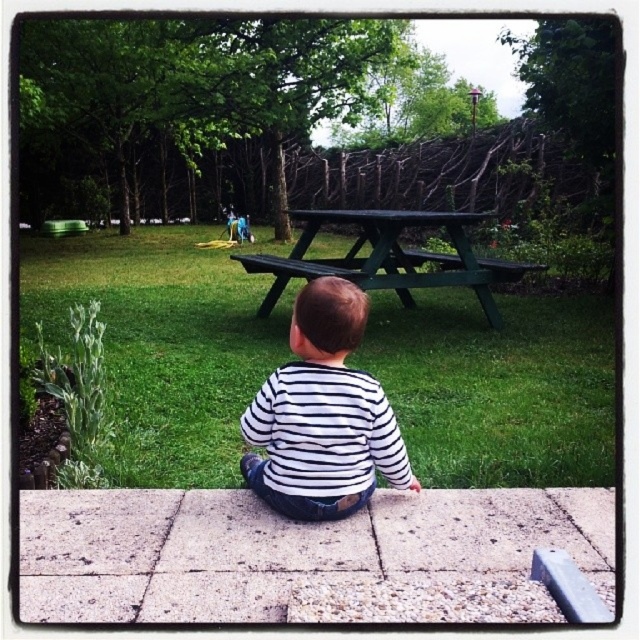
In the park scene, you see a child sitting on a paved area and two objects in the middle ground. Which object is positioned to the left of the other between the green grass at center and the green matte picnic table at center?

The green grass at center is to the left of the green matte picnic table at center.

You are a parent trying to decide where to place a small toy for your child to find. The toy is 30 cm wide. You have two options in the scene shown. Which location would you choose between the green grass at center and the green matte picnic table at center?

The green grass at center might be wider than the green matte picnic table at center, so placing the toy on the green grass at center would be more suitable since it has more space to accommodate the 30 cm wide toy.